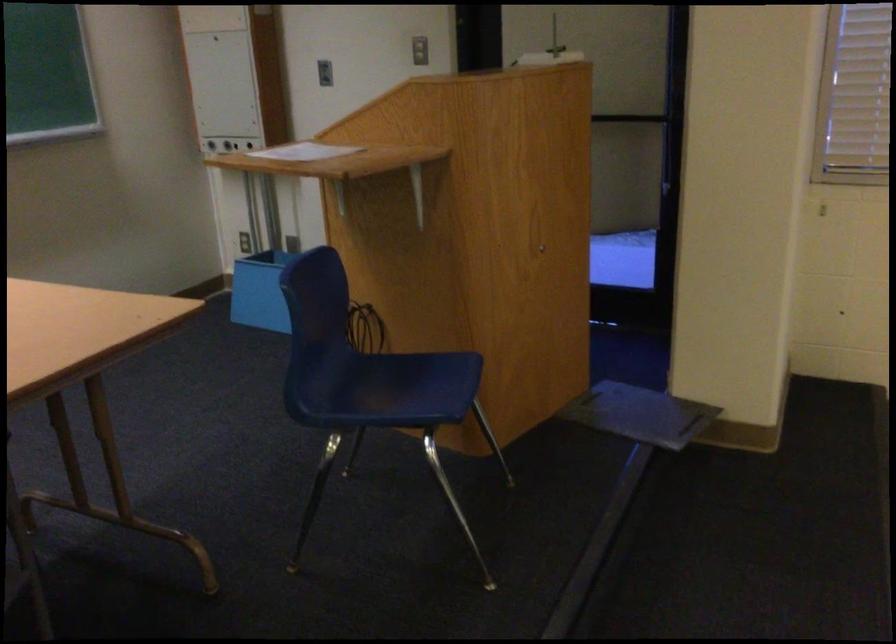
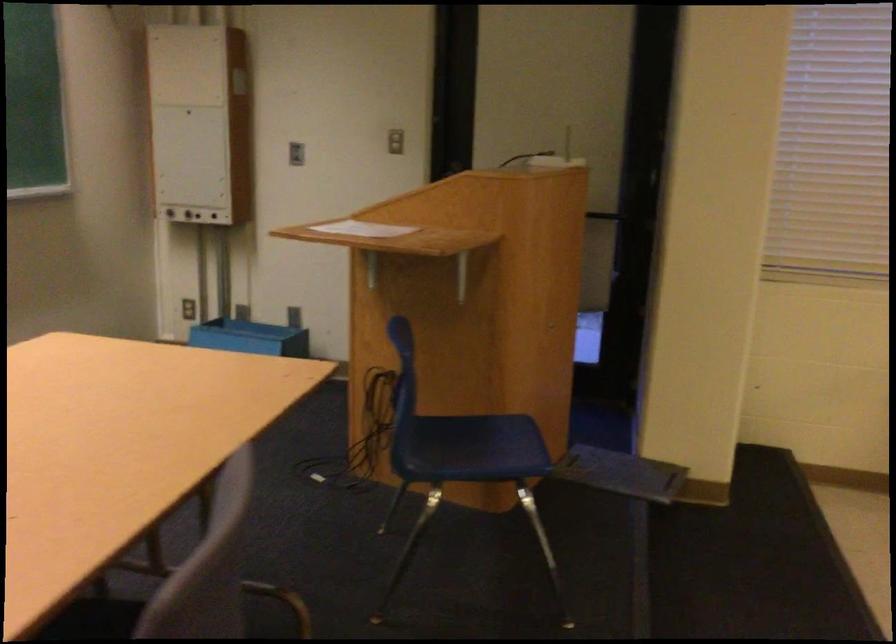
Question: In a continuous first-person perspective shot, in which direction is the camera moving?

Choices:
 (A) Left
 (B) Right
 (C) Forward
 (D) Backward

Answer: (A)